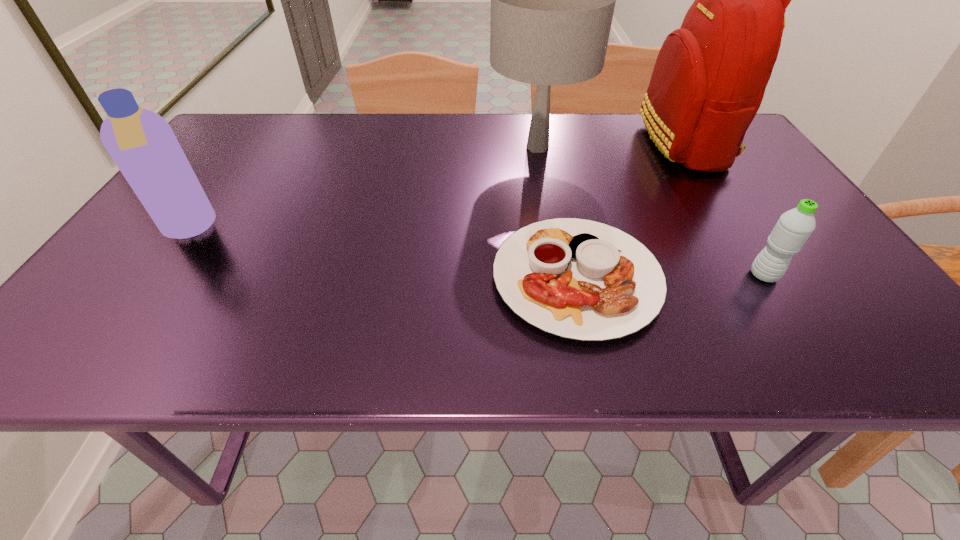
Identify the location of empty space that is in between the leftmost object and the shortest object. The width and height of the screenshot is (960, 540). pyautogui.click(x=382, y=254).

Find the location of a particular element. empty space that is in between the leftmost object and the backpack is located at coordinates (436, 186).

Where is `blank region between the platter and the leftmost object`? blank region between the platter and the leftmost object is located at coordinates (382, 254).

The image size is (960, 540). Identify the location of free space between the tallest object and the second tallest object. (611, 145).

At what (x,y) coordinates should I click in order to perform the action: click on vacant area that lies between the tallest object and the lampshade. Please return your answer as a coordinate pair (x, y). This screenshot has width=960, height=540. Looking at the image, I should click on (611, 145).

Locate an element on the screen. vacant area that lies between the shortest object and the water bottle is located at coordinates (670, 277).

Find the location of a particular element. The height and width of the screenshot is (540, 960). vacant region between the lampshade and the tallest object is located at coordinates (611, 145).

Choose which object is the third nearest neighbor to the fourth shortest object. Please provide its 2D coordinates. Your answer should be formatted as a tuple, i.e. [(x, y)], where the tuple contains the x and y coordinates of a point satisfying the conditions above.

[(794, 227)]

Select which object appears as the second closest to the lampshade. Please provide its 2D coordinates. Your answer should be formatted as a tuple, i.e. [(x, y)], where the tuple contains the x and y coordinates of a point satisfying the conditions above.

[(580, 279)]

I want to click on free space that satisfies the following two spatial constraints: 1. on the front-facing side of the shortest object; 2. on the left side of the fourth shortest object, so click(x=561, y=278).